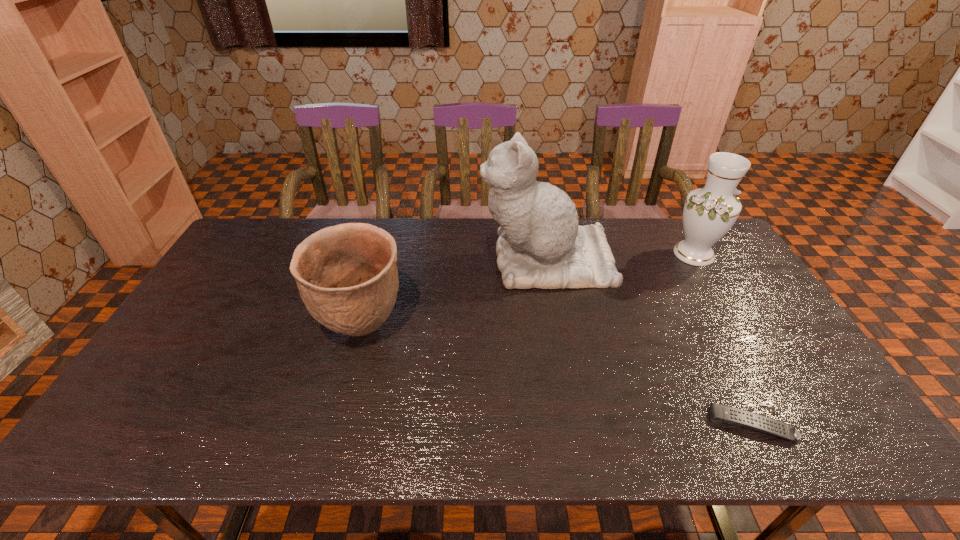
In order to click on empty location between the tallest object and the third farthest object in this screenshot , I will do `click(455, 294)`.

Locate an element on the screen. This screenshot has height=540, width=960. unoccupied area between the second nearest object and the second tallest object is located at coordinates (528, 291).

The height and width of the screenshot is (540, 960). I want to click on free spot between the pottery and the cat, so click(x=455, y=294).

At what (x,y) coordinates should I click in order to perform the action: click on free space between the second shortest object and the vase. Please return your answer as a coordinate pair (x, y). This screenshot has width=960, height=540. Looking at the image, I should click on (528, 291).

Locate which object is the second closest to the cat. Please provide its 2D coordinates. Your answer should be formatted as a tuple, i.e. [(x, y)], where the tuple contains the x and y coordinates of a point satisfying the conditions above.

[(347, 276)]

Find the location of a particular element. This screenshot has height=540, width=960. object that is the closest to the tallest object is located at coordinates (709, 212).

At what (x,y) coordinates should I click in order to perform the action: click on vacant space that satisfies the following two spatial constraints: 1. on the back side of the nearest object; 2. on the left side of the second tallest object. Please return your answer as a coordinate pair (x, y). The image size is (960, 540). Looking at the image, I should click on (664, 254).

Where is `blank space that satisfies the following two spatial constraints: 1. on the front-facing side of the third object from right to left; 2. on the front side of the leftmost object`? This screenshot has width=960, height=540. blank space that satisfies the following two spatial constraints: 1. on the front-facing side of the third object from right to left; 2. on the front side of the leftmost object is located at coordinates (559, 328).

You are a GUI agent. You are given a task and a screenshot of the screen. Output one action in this format:
    pyautogui.click(x=<x>, y=<y>)
    Task: Click on the free space that satisfies the following two spatial constraints: 1. on the front-facing side of the tallest object; 2. on the right side of the shortest object
    The height and width of the screenshot is (540, 960).
    Given the screenshot: What is the action you would take?
    (577, 424)

Locate an element on the screen. The image size is (960, 540). vacant space that satisfies the following two spatial constraints: 1. on the front-facing side of the third object from right to left; 2. on the right side of the nearest object is located at coordinates (577, 424).